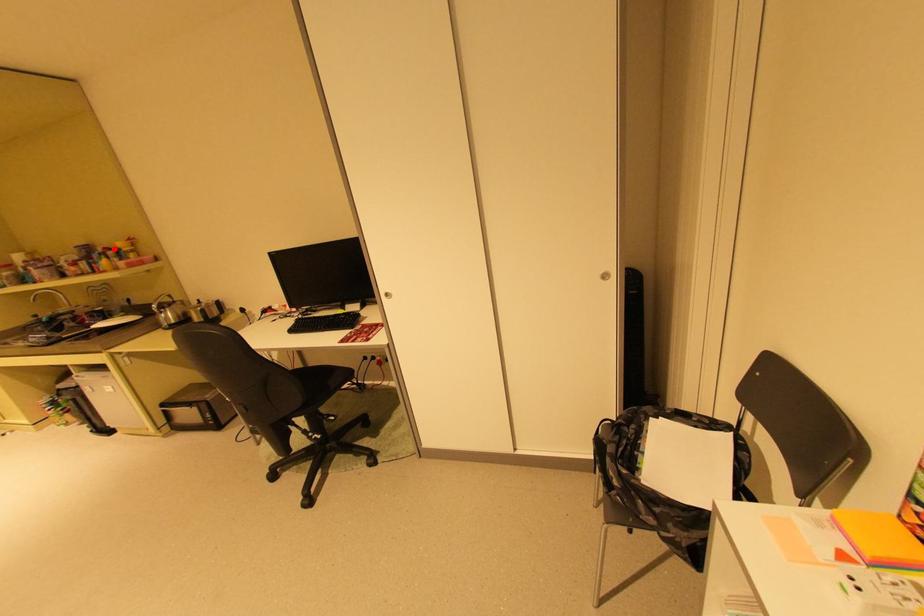
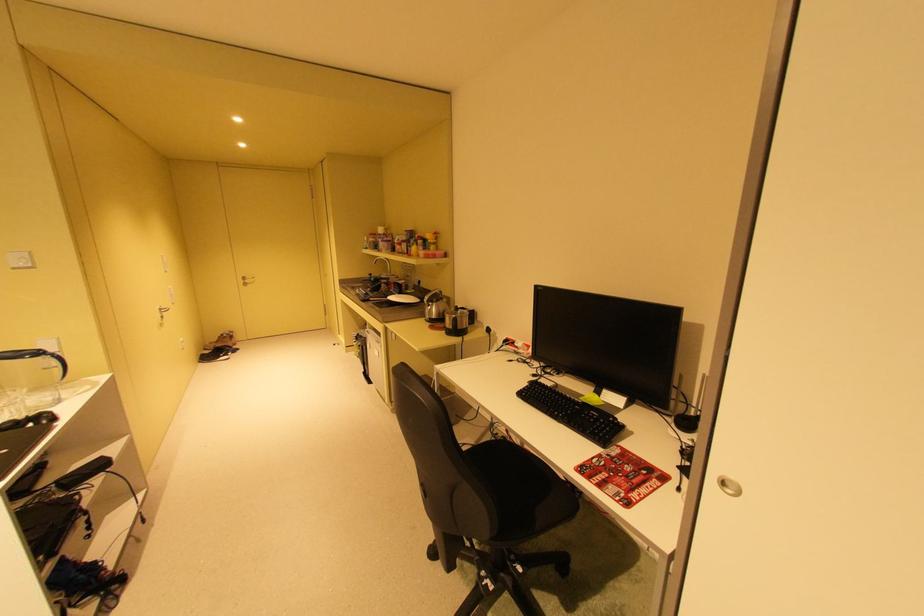
Find the pixel in the second image that matches the highlighted location in the first image.

(428, 237)